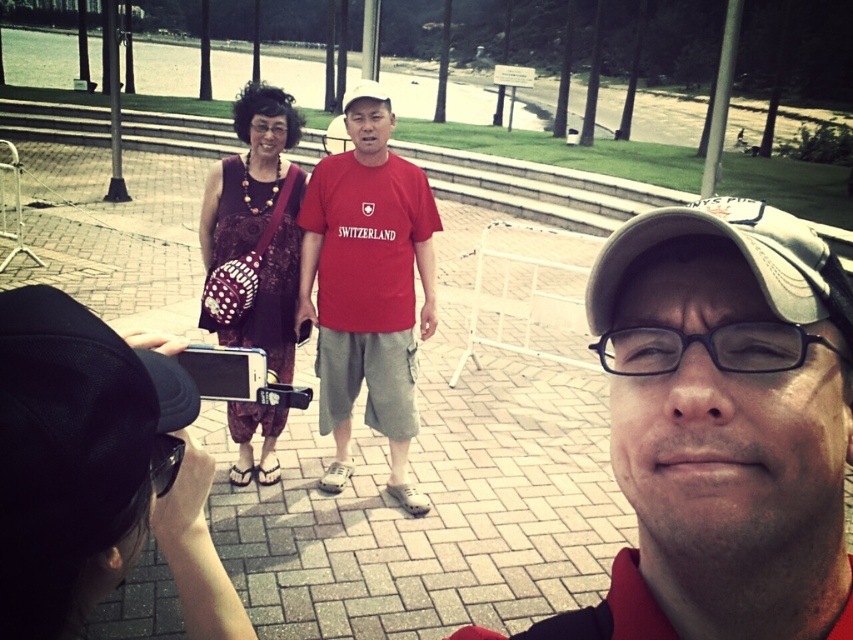
Between matte red t-shirt at center and dotted fabric dress at center, which one appears on the right side from the viewer's perspective?

Positioned to the right is matte red t-shirt at center.

The width and height of the screenshot is (853, 640). In order to click on matte red t-shirt at center in this screenshot , I will do `click(367, 285)`.

What do you see at coordinates (367, 285) in the screenshot? This screenshot has height=640, width=853. I see `matte red t-shirt at center` at bounding box center [367, 285].

Locate an element on the screen. matte red t-shirt at center is located at coordinates (367, 285).